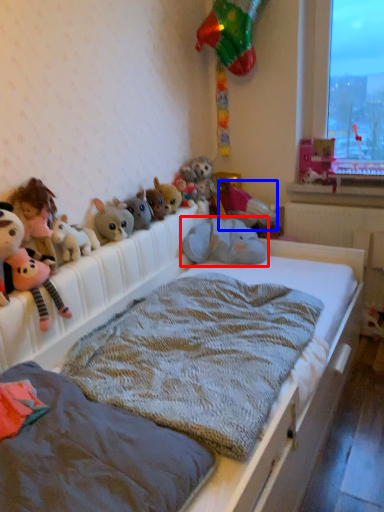
Question: Among these objects, which one is nearest to the camera, toy (highlighted by a red box) or toy (highlighted by a blue box)?

Choices:
 (A) toy
 (B) toy

Answer: (A)